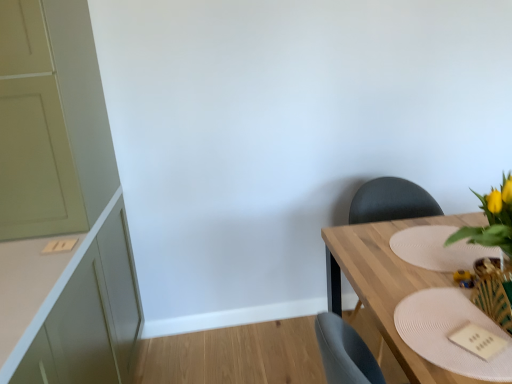
This screenshot has width=512, height=384. Describe the element at coordinates (438, 249) in the screenshot. I see `white textured placemat at right, positioned as the 2th plate in front-to-back order` at that location.

This screenshot has height=384, width=512. Describe the element at coordinates (60, 206) in the screenshot. I see `matte green cabinet at left` at that location.

What do you see at coordinates (494, 291) in the screenshot? The image size is (512, 384). I see `wooden textured vase at lower right` at bounding box center [494, 291].

What do you see at coordinates (391, 201) in the screenshot? I see `matte black chair at right` at bounding box center [391, 201].

This screenshot has width=512, height=384. What do you see at coordinates (492, 246) in the screenshot?
I see `yellow artificial flowers at right` at bounding box center [492, 246].

This screenshot has height=384, width=512. What do you see at coordinates (449, 332) in the screenshot?
I see `white textured placemat at lower right, marked as the second plate in a back-to-front arrangement` at bounding box center [449, 332].

Find the location of `wooden table at right`. wooden table at right is located at coordinates (388, 283).

Is point (331, 288) closer to camera compared to point (38, 138)?

No.

Can you confirm if wooden table at right is positioned to the left of matte green cabinet at left?

No.

Does wooden table at right have a greater width compared to matte green cabinet at left?

Correct, the width of wooden table at right exceeds that of matte green cabinet at left.

Considering the sizes of objects wooden table at right and matte green cabinet at left in the image provided, who is smaller, wooden table at right or matte green cabinet at left?

wooden table at right.

This screenshot has width=512, height=384. Identify the location of table behind the white textured placemat at lower right, which is counted as the 1th plate, starting from the front. (388, 283).

From a real-world perspective, between wooden table at right and white textured placemat at lower right, marked as the second plate in a back-to-front arrangement, who is vertically lower?

wooden table at right.

Is wooden table at right wider or thinner than white textured placemat at lower right, marked as the second plate in a back-to-front arrangement?

Considering their sizes, wooden table at right looks broader than white textured placemat at lower right, marked as the second plate in a back-to-front arrangement.

Considering the positions of objects wooden table at right and white textured placemat at lower right, which ranks as the 2th plate in top-to-bottom order, in the image provided, who is in front, wooden table at right or white textured placemat at lower right, which ranks as the 2th plate in top-to-bottom order,?

white textured placemat at lower right, which ranks as the 2th plate in top-to-bottom order, is more forward.

Which point is more distant from viewer, (x=488, y=293) or (x=55, y=47)?

The point (x=55, y=47) is farther.

From the image's perspective, is wooden textured vase at lower right on matte green cabinet at left?

No, from the image's perspective, wooden textured vase at lower right is not on top of matte green cabinet at left.

From a real-world perspective, who is located lower, wooden textured vase at lower right or matte green cabinet at left?

In real-world perspective, wooden textured vase at lower right is lower.

Consider the image. Is the position of wooden textured vase at lower right more distant than that of matte green cabinet at left?

No, wooden textured vase at lower right is closer to the camera.

Which of these two, yellow artificial flowers at right or matte black chair at right, is bigger?

matte black chair at right.

Which object is closer to the camera, yellow artificial flowers at right or matte black chair at right?

yellow artificial flowers at right is closer to the camera.

Is yellow artificial flowers at right completely or partially outside of matte black chair at right?

Yes, yellow artificial flowers at right is located beyond the bounds of matte black chair at right.

Find the location of a particular element. floral arrangement located above the matte black chair at right (from a real-world perspective) is located at coordinates (492, 246).

Considering the relative sizes of wooden table at right and matte black chair at right in the image provided, is wooden table at right wider than matte black chair at right?

Yes, wooden table at right is wider than matte black chair at right.

Is point (417, 362) closer or farther from the camera than point (395, 189)?

Point (417, 362) appears to be closer to the viewer than point (395, 189).

Considering the relative sizes of wooden table at right and matte black chair at right in the image provided, is wooden table at right bigger than matte black chair at right?

Indeed, wooden table at right has a larger size compared to matte black chair at right.

How many degrees apart are the facing directions of wooden table at right and matte black chair at right?

90.4 degrees.

Measure the distance from yellow artificial flowers at right to white textured placemat at lower right, arranged as the first plate when ordered from the bottom.

They are 5.71 inches apart.

Identify the location of the 1st plate behind the yellow artificial flowers at right, starting your count from the anchor. This screenshot has height=384, width=512. (449, 332).

Would you say yellow artificial flowers at right contains white textured placemat at lower right, which ranks as the 2th plate in top-to-bottom order?

No, white textured placemat at lower right, which ranks as the 2th plate in top-to-bottom order, is not inside yellow artificial flowers at right.

Are yellow artificial flowers at right and white textured placemat at lower right, marked as the second plate in a back-to-front arrangement, beside each other?

yellow artificial flowers at right and white textured placemat at lower right, marked as the second plate in a back-to-front arrangement, are not in contact.

Would you say yellow artificial flowers at right contains wooden textured vase at lower right?

Yes, yellow artificial flowers at right contains wooden textured vase at lower right.

Considering the relative sizes of yellow artificial flowers at right and wooden textured vase at lower right in the image provided, is yellow artificial flowers at right smaller than wooden textured vase at lower right?

Actually, yellow artificial flowers at right might be larger than wooden textured vase at lower right.

From the image's perspective, which one is positioned higher, yellow artificial flowers at right or wooden textured vase at lower right?

yellow artificial flowers at right is shown above in the image.

Looking at this image, which of these two, yellow artificial flowers at right or wooden textured vase at lower right, is wider?

Wider between the two is yellow artificial flowers at right.

In order to click on cabinetry above the wooden table at right (from the image's perspective) in this screenshot , I will do `click(60, 206)`.

Image resolution: width=512 pixels, height=384 pixels. Find the location of `table that is under the white textured placemat at lower right, which ranks as the 2th plate in top-to-bottom order (from a real-world perspective)`. table that is under the white textured placemat at lower right, which ranks as the 2th plate in top-to-bottom order (from a real-world perspective) is located at coordinates (388, 283).

Which object lies further to the anchor point white textured placemat at lower right, which is counted as the 1th plate, starting from the front, wooden textured vase at lower right or wooden table at right?

wooden table at right is positioned further to the anchor white textured placemat at lower right, which is counted as the 1th plate, starting from the front.

From the image, which object appears to be farther from matte green cabinet at left, white textured placemat at right, the 1th plate viewed from the back, or yellow artificial flowers at right?

yellow artificial flowers at right is further to matte green cabinet at left.

Considering their positions, is wooden textured vase at lower right positioned further to yellow artificial flowers at right than matte green cabinet at left?

Based on the image, matte green cabinet at left appears to be further to yellow artificial flowers at right.

From the image, which object appears to be farther from wooden table at right, white textured placemat at right, positioned as the 2th plate in front-to-back order, or matte black chair at right?

The object further to wooden table at right is matte black chair at right.

Which object lies nearer to the anchor point wooden table at right, matte green cabinet at left or wooden textured vase at lower right?

wooden textured vase at lower right is closer to wooden table at right.

When comparing their distances from white textured placemat at right, positioned as the 2th plate in front-to-back order, does yellow artificial flowers at right or matte green cabinet at left seem closer?

Among the two, yellow artificial flowers at right is located nearer to white textured placemat at right, positioned as the 2th plate in front-to-back order.

From the image, which object appears to be nearer to matte black chair at right, white textured placemat at right, placed as the 2th plate when sorted from bottom to top, or wooden table at right?

Based on the image, wooden table at right appears to be nearer to matte black chair at right.

From the image, which object appears to be farther from matte black chair at right, white textured placemat at lower right, which is counted as the 1th plate, starting from the front, or matte green cabinet at left?

matte green cabinet at left lies further to matte black chair at right than the other object.

Locate an element on the screen. This screenshot has height=384, width=512. vase positioned between white textured placemat at lower right, which is counted as the 1th plate, starting from the front, and matte black chair at right from near to far is located at coordinates (494, 291).

Locate an element on the screen. This screenshot has height=384, width=512. floral arrangement between matte green cabinet at left and wooden table at right from left to right is located at coordinates (492, 246).

You are a GUI agent. You are given a task and a screenshot of the screen. Output one action in this format:
    pyautogui.click(x=<x>, y=<y>)
    Task: Click on the vase positioned between white textured placemat at lower right, arranged as the first plate when ordered from the bottom, and white textured placemat at right, the 1th plate viewed from the back, from near to far
    
    Given the screenshot: What is the action you would take?
    pyautogui.click(x=494, y=291)

Where is `plate between matte green cabinet at left and yellow artificial flowers at right from left to right`? The image size is (512, 384). plate between matte green cabinet at left and yellow artificial flowers at right from left to right is located at coordinates (449, 332).